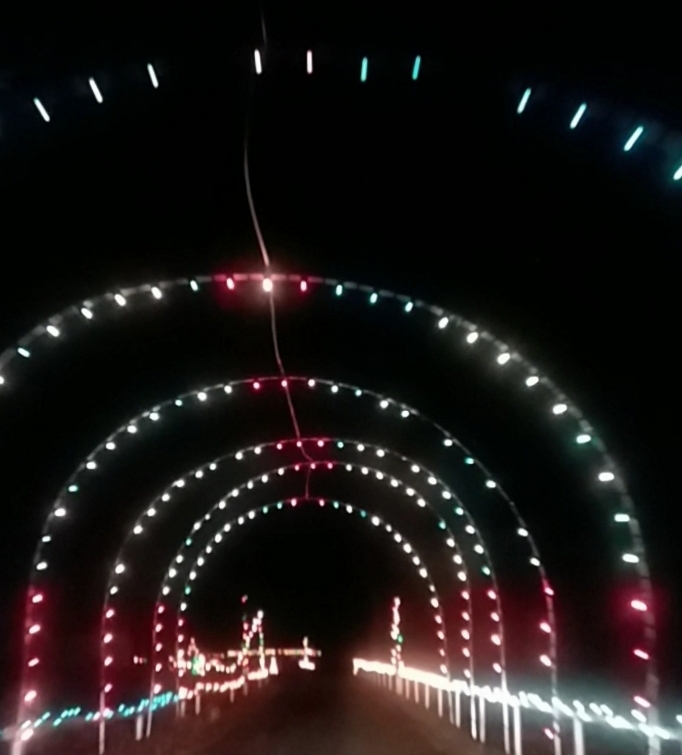
Find the location of a particular element. The height and width of the screenshot is (755, 682). light string is located at coordinates (138, 704), (398, 667), (419, 565), (447, 544), (466, 529), (520, 535), (605, 478), (520, 103).